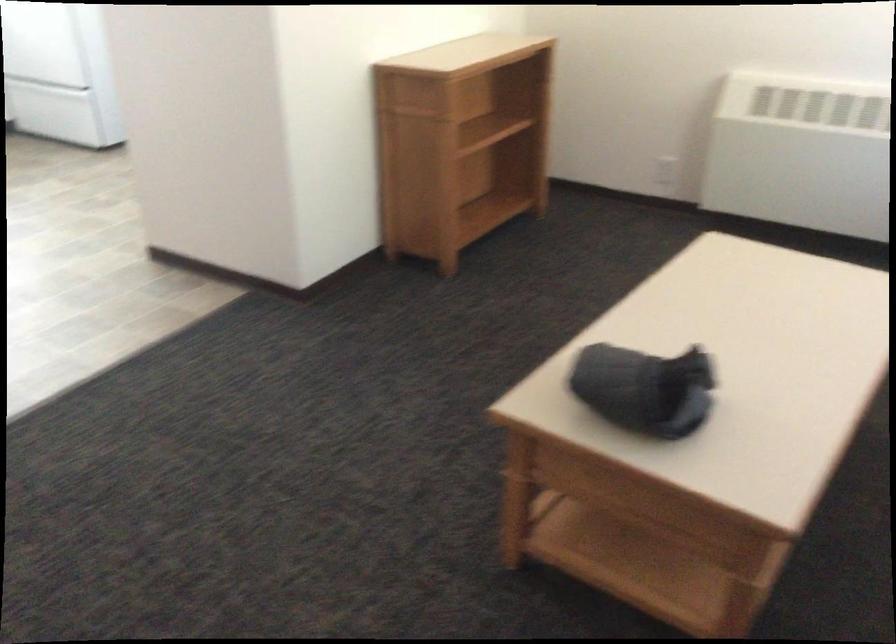
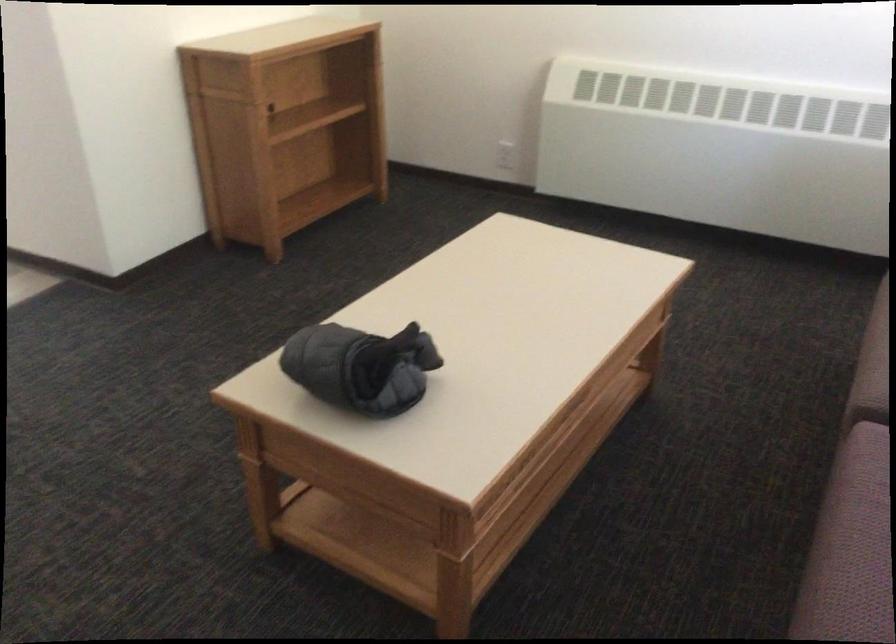
In the second image, find the point that corresponds to pixel 666 171 in the first image.

(505, 155)